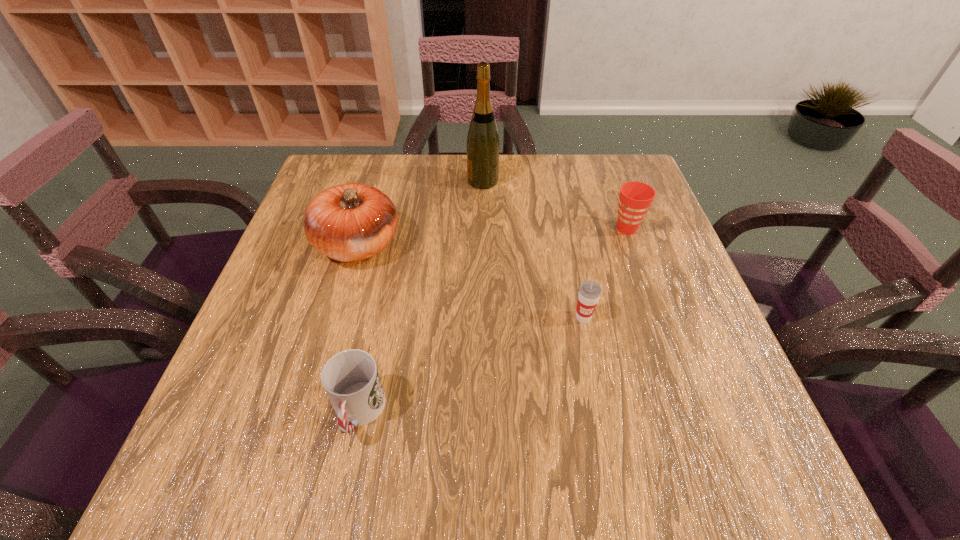
Locate an element on the screen. The height and width of the screenshot is (540, 960). vacant space located 0.130m on the front-facing side of the wine bottle is located at coordinates (420, 181).

I want to click on vacant space located 0.370m on the front-facing side of the wine bottle, so coord(333,181).

At what (x,y) coordinates should I click in order to perform the action: click on free space located 0.310m on the back of the fourth shortest object. Please return your answer as a coordinate pair (x, y). The image size is (960, 540). Looking at the image, I should click on (384, 154).

The image size is (960, 540). Find the location of `free space located on the side of the second cup from left to right with the logo`. free space located on the side of the second cup from left to right with the logo is located at coordinates (606, 427).

Where is `free space located 0.220m on the front of the farthest cup`? This screenshot has width=960, height=540. free space located 0.220m on the front of the farthest cup is located at coordinates (656, 310).

Where is `object that is at the far edge`? Image resolution: width=960 pixels, height=540 pixels. object that is at the far edge is located at coordinates (483, 144).

Identify the location of object that is at the near edge. (351, 380).

Identify the location of object located at the left edge. This screenshot has height=540, width=960. (350, 222).

You are a GUI agent. You are given a task and a screenshot of the screen. Output one action in this format:
    pyautogui.click(x=<x>, y=<y>)
    Task: Click on the object located at the right edge
    This screenshot has width=960, height=540.
    Given the screenshot: What is the action you would take?
    pyautogui.click(x=635, y=198)

Identify the location of vacant space at the far edge of the desktop. This screenshot has width=960, height=540. (520, 179).